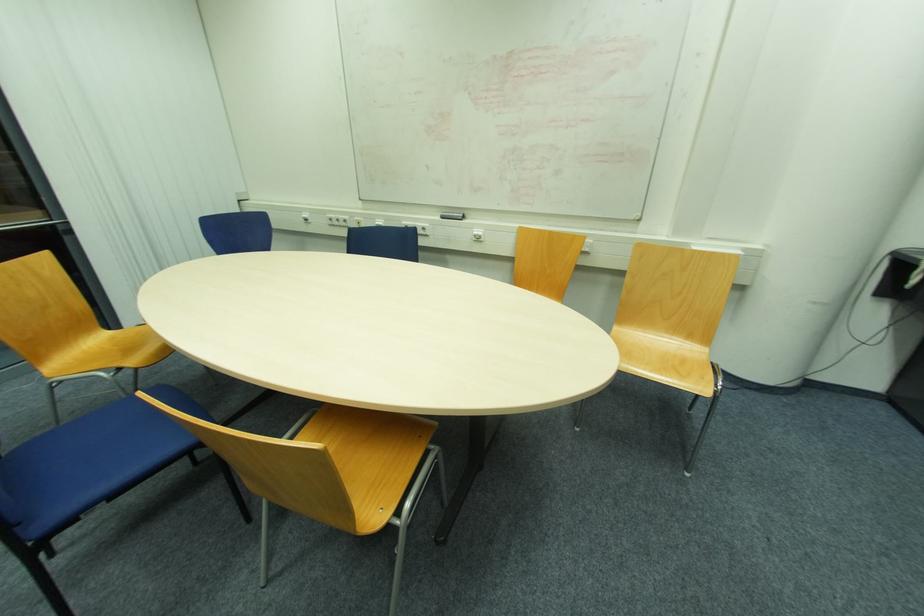
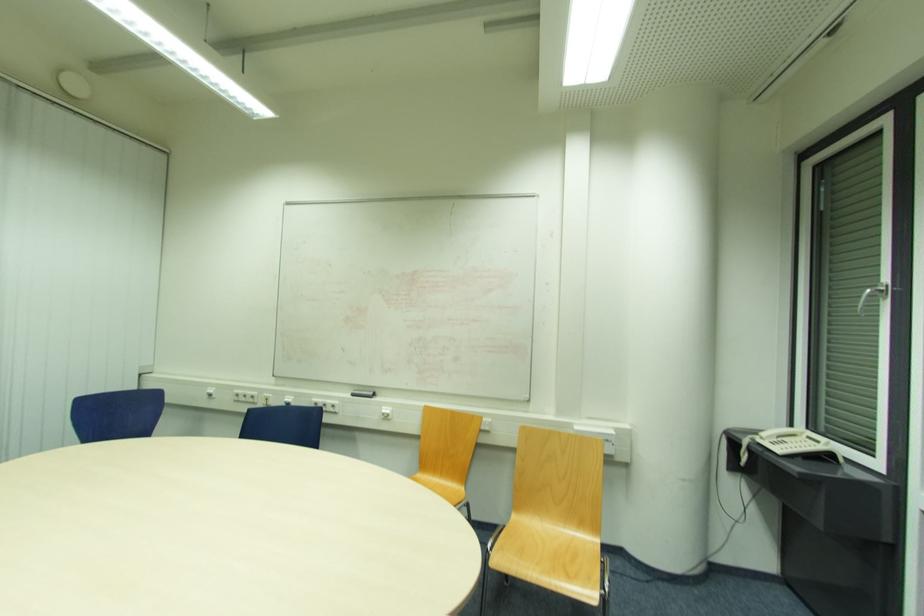
Find the pixel in the second image that matches point (444, 217) in the first image.

(355, 395)